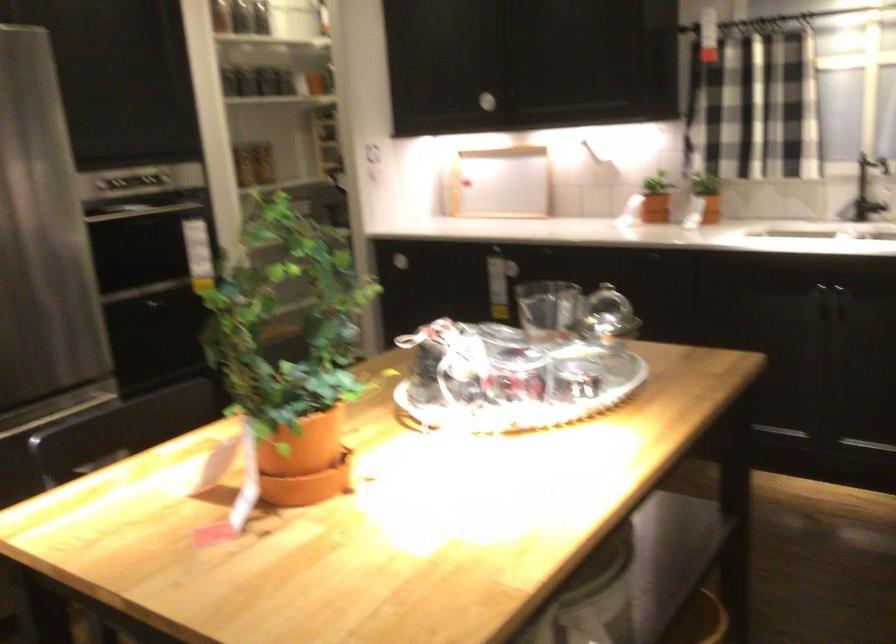
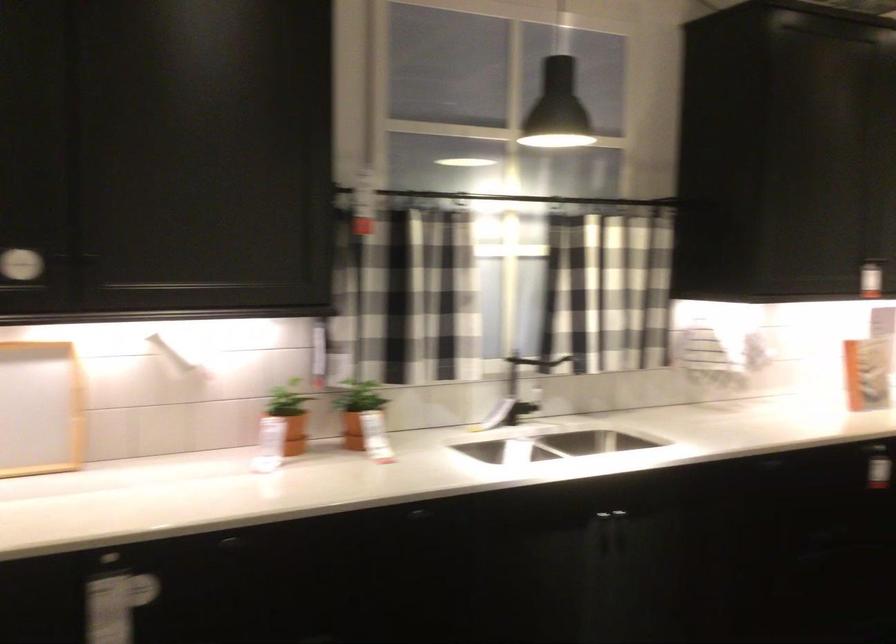
Where in the second image is the point corresponding to point (763, 96) from the first image?

(403, 295)